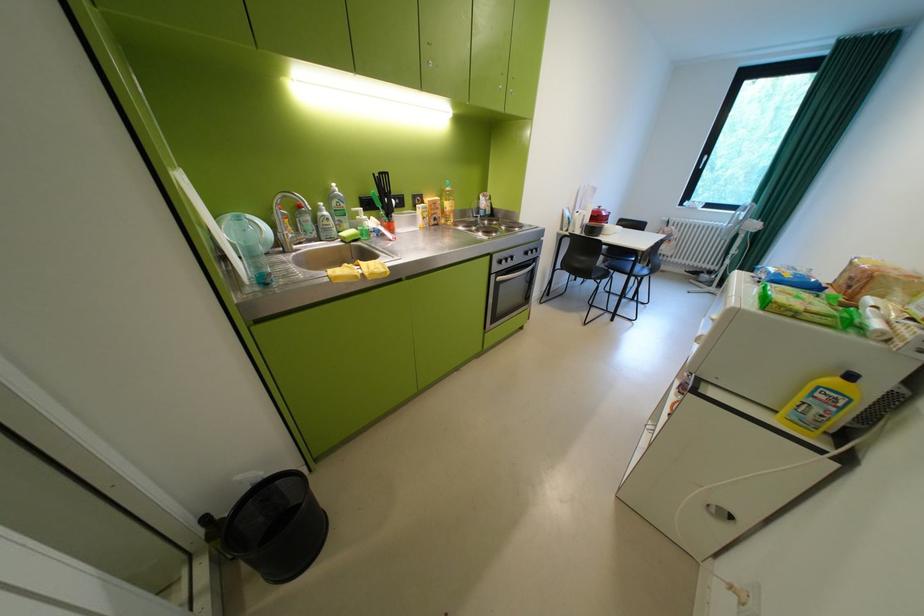
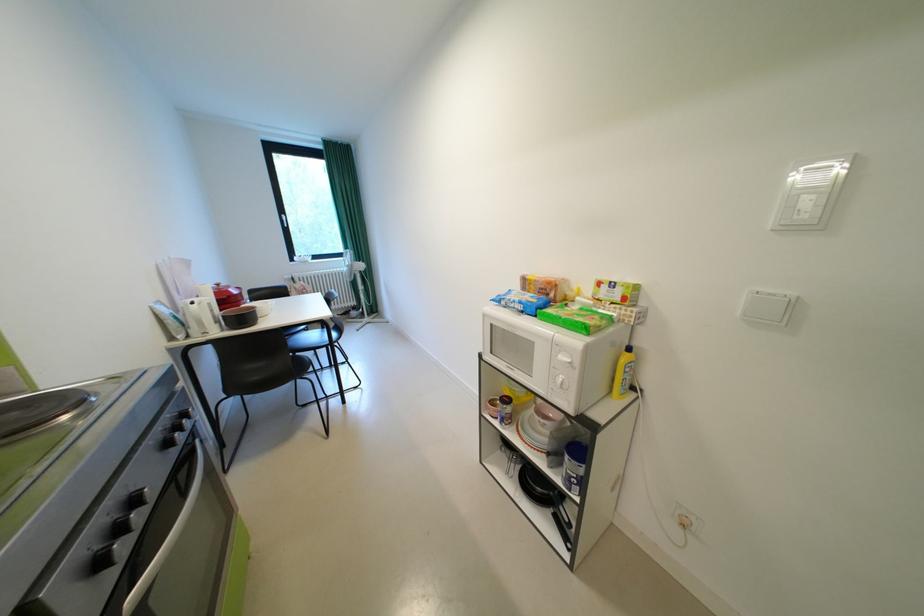
Question: The camera is either moving clockwise (left) or counter-clockwise (right) around the object. The first image is from the beginning of the video and the second image is from the end. Is the camera moving left or right when shooting the video?

Choices:
 (A) Left
 (B) Right

Answer: (A)